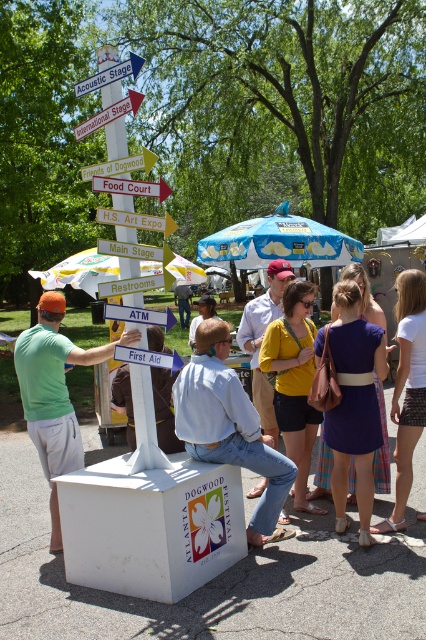
Question: Among these points, which one is farthest from the camera?

Choices:
 (A) (209, 296)
 (B) (331, 323)
 (C) (108, 124)
 (D) (155, 221)

Answer: (A)

Question: Which object is closer to the camera taking this photo?

Choices:
 (A) yellow wooden signpost at center
 (B) green matte shirt at left
 (C) matte brown hair at center
 (D) metallic silver sign at center

Answer: (D)

Question: Does white plastic directional sign at upper center appear under wooden signpost at upper center?

Choices:
 (A) yes
 (B) no

Answer: (B)

Question: Is light blue denim shirt at center positioned in front of white plastic directional sign at upper center?

Choices:
 (A) no
 (B) yes

Answer: (A)

Question: Considering the real-world distances, which object is farthest from the matte purple dress at center?

Choices:
 (A) green matte shirt at left
 (B) light blue denim shirt at center
 (C) yellow wooden signpost at center
 (D) purple fabric dress at center

Answer: (C)

Question: Is green plastic sign at center to the left of wooden signpost at upper center from the viewer's perspective?

Choices:
 (A) yes
 (B) no

Answer: (B)